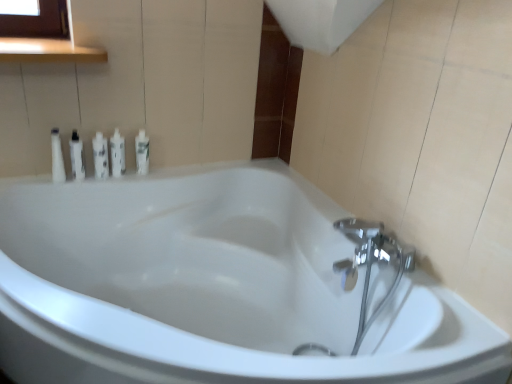
The width and height of the screenshot is (512, 384). What do you see at coordinates (117, 154) in the screenshot?
I see `white glossy bottle at upper left, the 2th toiletry viewed from the right` at bounding box center [117, 154].

How much space does white glossy bottle at left, which ranks as the fifth toiletry in right-to-left order, occupy vertically?

white glossy bottle at left, which ranks as the fifth toiletry in right-to-left order, is 21.98 centimeters in height.

This screenshot has width=512, height=384. In order to click on white glossy bottle at left, which ranks as the fifth toiletry in right-to-left order in this screenshot , I will do `click(57, 157)`.

Describe the element at coordinates (77, 156) in the screenshot. The width and height of the screenshot is (512, 384). I see `white glossy tube at upper left, the fourth toiletry in the right-to-left sequence` at that location.

What is the approximate width of white glossy tube at upper left, positioned as the 2th toiletry in left-to-right order?

2.31 inches.

Identify the location of white glossy bottle at upper left, which is the 4th toiletry from left to right. (117, 154).

Considering the sizes of objects white glossy bathtub at center and white glossy tube at upper left, positioned as the 2th toiletry in left-to-right order, in the image provided, who is bigger, white glossy bathtub at center or white glossy tube at upper left, positioned as the 2th toiletry in left-to-right order,?

white glossy bathtub at center is bigger.

In terms of width, does white glossy bathtub at center look wider or thinner when compared to white glossy tube at upper left, positioned as the 2th toiletry in left-to-right order?

Considering their sizes, white glossy bathtub at center looks broader than white glossy tube at upper left, positioned as the 2th toiletry in left-to-right order.

Considering the relative sizes of white glossy bathtub at center and white glossy tube at upper left, the fourth toiletry in the right-to-left sequence, in the image provided, is white glossy bathtub at center taller than white glossy tube at upper left, the fourth toiletry in the right-to-left sequence,?

Correct, white glossy bathtub at center is much taller as white glossy tube at upper left, the fourth toiletry in the right-to-left sequence.

Is white glossy lotion at center, which ranks as the 3th toiletry in left-to-right order, facing towards white glossy tube at upper left, positioned as the 2th toiletry in left-to-right order?

No, white glossy lotion at center, which ranks as the 3th toiletry in left-to-right order, does not turn towards white glossy tube at upper left, positioned as the 2th toiletry in left-to-right order.

Is white glossy lotion at center, which ranks as the 3th toiletry in left-to-right order, taller than white glossy tube at upper left, the fourth toiletry in the right-to-left sequence?

Correct, white glossy lotion at center, which ranks as the 3th toiletry in left-to-right order, is much taller as white glossy tube at upper left, the fourth toiletry in the right-to-left sequence.

Measure the distance from white glossy lotion at center, acting as the third toiletry starting from the right, to white glossy tube at upper left, the fourth toiletry in the right-to-left sequence.

The distance of white glossy lotion at center, acting as the third toiletry starting from the right, from white glossy tube at upper left, the fourth toiletry in the right-to-left sequence, is 2.85 inches.

Locate an element on the screen. The width and height of the screenshot is (512, 384). the 1st toiletry above when counting from the white glossy tube at upper left, positioned as the 2th toiletry in left-to-right order (from the image's perspective) is located at coordinates (100, 156).

Does white glossy bottle at upper left, positioned as the first toiletry in right-to-left order, have a smaller size compared to white glossy bottle at upper left, which is the 4th toiletry from left to right?

No.

Who is more distant, white glossy bottle at upper left, positioned as the first toiletry in right-to-left order, or white glossy bottle at upper left, which is the 4th toiletry from left to right?

white glossy bottle at upper left, positioned as the first toiletry in right-to-left order, is further from the camera.

How distant is white glossy bottle at upper left, positioned as the first toiletry in right-to-left order, from white glossy bottle at upper left, which is the 4th toiletry from left to right?

3.15 inches.

Between white glossy bottle at upper left, which is counted as the fifth toiletry, starting from the left, and white glossy bottle at upper left, the 2th toiletry viewed from the right, which one has less height?

With less height is white glossy bottle at upper left, which is counted as the fifth toiletry, starting from the left.

You are a GUI agent. You are given a task and a screenshot of the screen. Output one action in this format:
    pyautogui.click(x=<x>, y=<y>)
    Task: Click on the toiletry that is the 4th object located behind the white glossy bottle at left, the first toiletry positioned from the left
    
    Given the screenshot: What is the action you would take?
    pyautogui.click(x=142, y=152)

From the picture: From a real-world perspective, who is located higher, white glossy bottle at upper left, positioned as the first toiletry in right-to-left order, or white glossy bottle at left, the first toiletry positioned from the left?

From a 3D spatial view, white glossy bottle at left, the first toiletry positioned from the left, is above.

Based on their sizes in the image, would you say white glossy bottle at upper left, positioned as the first toiletry in right-to-left order, is bigger or smaller than white glossy bottle at left, which ranks as the fifth toiletry in right-to-left order?

In the image, white glossy bottle at upper left, positioned as the first toiletry in right-to-left order, appears to be smaller than white glossy bottle at left, which ranks as the fifth toiletry in right-to-left order.

Is white glossy bottle at upper left, positioned as the first toiletry in right-to-left order, at the left side of white glossy lotion at center, acting as the third toiletry starting from the right?

In fact, white glossy bottle at upper left, positioned as the first toiletry in right-to-left order, is to the right of white glossy lotion at center, acting as the third toiletry starting from the right.

Considering the sizes of objects white glossy bottle at upper left, positioned as the first toiletry in right-to-left order, and white glossy lotion at center, acting as the third toiletry starting from the right, in the image provided, who is taller, white glossy bottle at upper left, positioned as the first toiletry in right-to-left order, or white glossy lotion at center, acting as the third toiletry starting from the right,?

white glossy lotion at center, acting as the third toiletry starting from the right, is taller.

Does point (139, 131) come farther from viewer compared to point (94, 156)?

Yes, point (139, 131) is farther from viewer.

This screenshot has width=512, height=384. Find the location of `the 3rd toiletry directly above the white glossy bottle at upper left, which is counted as the fifth toiletry, starting from the left (from a real-world perspective)`. the 3rd toiletry directly above the white glossy bottle at upper left, which is counted as the fifth toiletry, starting from the left (from a real-world perspective) is located at coordinates (100, 156).

Does white glossy tube at upper left, positioned as the 2th toiletry in left-to-right order, have a larger size compared to white glossy bottle at upper left, which is counted as the fifth toiletry, starting from the left?

No.

Considering the sizes of objects white glossy tube at upper left, the fourth toiletry in the right-to-left sequence, and white glossy bottle at upper left, positioned as the first toiletry in right-to-left order, in the image provided, who is taller, white glossy tube at upper left, the fourth toiletry in the right-to-left sequence, or white glossy bottle at upper left, positioned as the first toiletry in right-to-left order,?

Standing taller between the two is white glossy tube at upper left, the fourth toiletry in the right-to-left sequence.

Does white glossy tube at upper left, positioned as the 2th toiletry in left-to-right order, touch white glossy bottle at upper left, which is counted as the fifth toiletry, starting from the left?

No, white glossy tube at upper left, positioned as the 2th toiletry in left-to-right order, is not next to white glossy bottle at upper left, which is counted as the fifth toiletry, starting from the left.

Relative to white glossy bottle at upper left, which is counted as the fifth toiletry, starting from the left, is white glossy tube at upper left, positioned as the 2th toiletry in left-to-right order, in front or behind?

Visually, white glossy tube at upper left, positioned as the 2th toiletry in left-to-right order, is located in front of white glossy bottle at upper left, which is counted as the fifth toiletry, starting from the left.

Could you tell me if white glossy bathtub at center is facing white glossy bottle at upper left, the 2th toiletry viewed from the right?

No, white glossy bathtub at center is not turned towards white glossy bottle at upper left, the 2th toiletry viewed from the right.

Is point (268, 241) closer or farther from the camera than point (114, 148)?

Point (268, 241) appears to be farther away from the viewer than point (114, 148).

Which is behind, white glossy bathtub at center or white glossy bottle at upper left, the 2th toiletry viewed from the right?

white glossy bottle at upper left, the 2th toiletry viewed from the right, is behind.

Which toiletry is the 4th one when counting from the back of the white glossy bathtub at center? Please provide its 2D coordinates.

[(117, 154)]

Image resolution: width=512 pixels, height=384 pixels. Find the location of `bathtub to the right of white glossy tube at upper left, positioned as the 2th toiletry in left-to-right order`. bathtub to the right of white glossy tube at upper left, positioned as the 2th toiletry in left-to-right order is located at coordinates (212, 287).

Identify the location of the 1st toiletry behind the white glossy tube at upper left, the fourth toiletry in the right-to-left sequence, starting your count from the anchor. This screenshot has width=512, height=384. (100, 156).

Looking at the image, which one is located further to white glossy bottle at left, the first toiletry positioned from the left, white glossy bathtub at center or white glossy lotion at center, acting as the third toiletry starting from the right?

white glossy bathtub at center is positioned further to the anchor white glossy bottle at left, the first toiletry positioned from the left.

Based on their spatial positions, is white glossy bottle at left, which ranks as the fifth toiletry in right-to-left order, or white glossy bathtub at center further from white glossy tube at upper left, the fourth toiletry in the right-to-left sequence?

Based on the image, white glossy bathtub at center appears to be further to white glossy tube at upper left, the fourth toiletry in the right-to-left sequence.

Looking at the image, which one is located closer to white glossy bathtub at center, white glossy bottle at left, the first toiletry positioned from the left, or white glossy bottle at upper left, the 2th toiletry viewed from the right?

white glossy bottle at upper left, the 2th toiletry viewed from the right, lies closer to white glossy bathtub at center than the other object.

Estimate the real-world distances between objects in this image. Which object is further from white glossy tube at upper left, the fourth toiletry in the right-to-left sequence, white glossy bottle at left, the first toiletry positioned from the left, or white glossy bottle at upper left, which is the 4th toiletry from left to right?

Based on the image, white glossy bottle at upper left, which is the 4th toiletry from left to right, appears to be further to white glossy tube at upper left, the fourth toiletry in the right-to-left sequence.

Looking at the image, which one is located closer to white glossy bathtub at center, white glossy bottle at upper left, the 2th toiletry viewed from the right, or white glossy lotion at center, which ranks as the 3th toiletry in left-to-right order?

white glossy bottle at upper left, the 2th toiletry viewed from the right, is positioned closer to the anchor white glossy bathtub at center.

Considering their positions, is white glossy bottle at left, the first toiletry positioned from the left, positioned further to white glossy tube at upper left, positioned as the 2th toiletry in left-to-right order, than white glossy bottle at upper left, which is counted as the fifth toiletry, starting from the left?

Based on the image, white glossy bottle at upper left, which is counted as the fifth toiletry, starting from the left, appears to be further to white glossy tube at upper left, positioned as the 2th toiletry in left-to-right order.

Based on their spatial positions, is white glossy tube at upper left, the fourth toiletry in the right-to-left sequence, or white glossy lotion at center, acting as the third toiletry starting from the right, further from white glossy bottle at left, the first toiletry positioned from the left?

white glossy lotion at center, acting as the third toiletry starting from the right.

Which object lies further to the anchor point white glossy tube at upper left, positioned as the 2th toiletry in left-to-right order, white glossy bottle at upper left, which is the 4th toiletry from left to right, or white glossy bottle at left, the first toiletry positioned from the left?

white glossy bottle at upper left, which is the 4th toiletry from left to right, lies further to white glossy tube at upper left, positioned as the 2th toiletry in left-to-right order, than the other object.

The image size is (512, 384). In order to click on toiletry between white glossy lotion at center, which ranks as the 3th toiletry in left-to-right order, and white glossy bottle at upper left, which is counted as the fifth toiletry, starting from the left in this screenshot , I will do `click(117, 154)`.

The image size is (512, 384). Find the location of `toiletry located between white glossy bathtub at center and white glossy tube at upper left, positioned as the 2th toiletry in left-to-right order, in the depth direction`. toiletry located between white glossy bathtub at center and white glossy tube at upper left, positioned as the 2th toiletry in left-to-right order, in the depth direction is located at coordinates (57, 157).

At what (x,y) coordinates should I click in order to perform the action: click on toiletry situated between white glossy bottle at left, the first toiletry positioned from the left, and white glossy lotion at center, acting as the third toiletry starting from the right, from left to right. Please return your answer as a coordinate pair (x, y). Image resolution: width=512 pixels, height=384 pixels. Looking at the image, I should click on (77, 156).

You are a GUI agent. You are given a task and a screenshot of the screen. Output one action in this format:
    pyautogui.click(x=<x>, y=<y>)
    Task: Click on the toiletry between white glossy tube at upper left, the fourth toiletry in the right-to-left sequence, and white glossy bottle at upper left, the 2th toiletry viewed from the right, in the horizontal direction
    This screenshot has width=512, height=384.
    Given the screenshot: What is the action you would take?
    pyautogui.click(x=100, y=156)